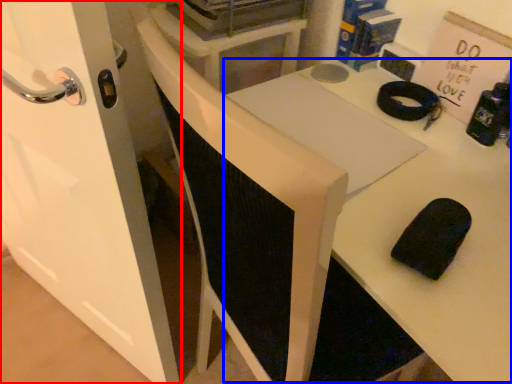
Question: Which object appears farthest to the camera in this image, door (highlighted by a red box) or table (highlighted by a blue box)?

Choices:
 (A) door
 (B) table

Answer: (A)